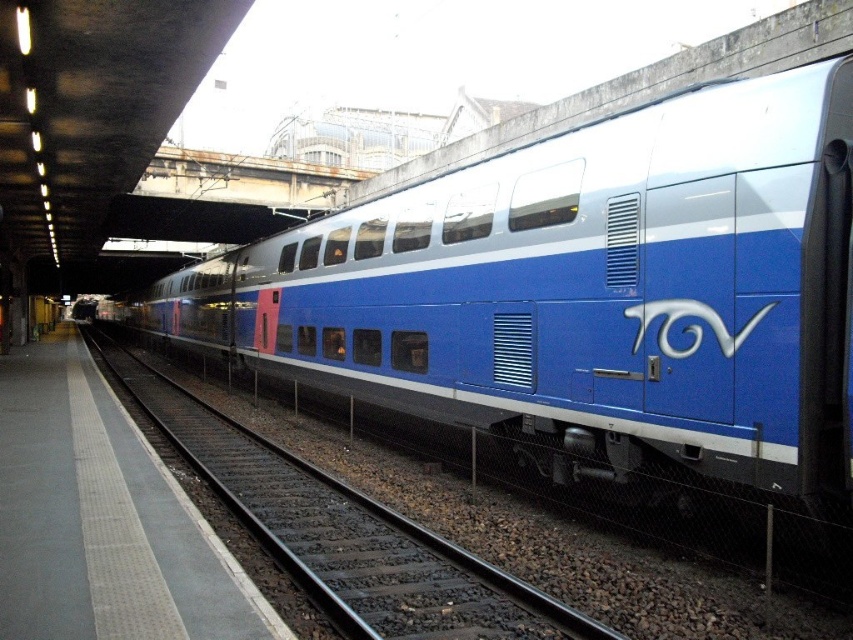
Can you confirm if blue metallic train at center is positioned below metal track at center?

Actually, blue metallic train at center is above metal track at center.

Is point (270, 269) behind point (231, 492)?

Yes, it is.

Locate an element on the screen. The height and width of the screenshot is (640, 853). blue metallic train at center is located at coordinates (589, 296).